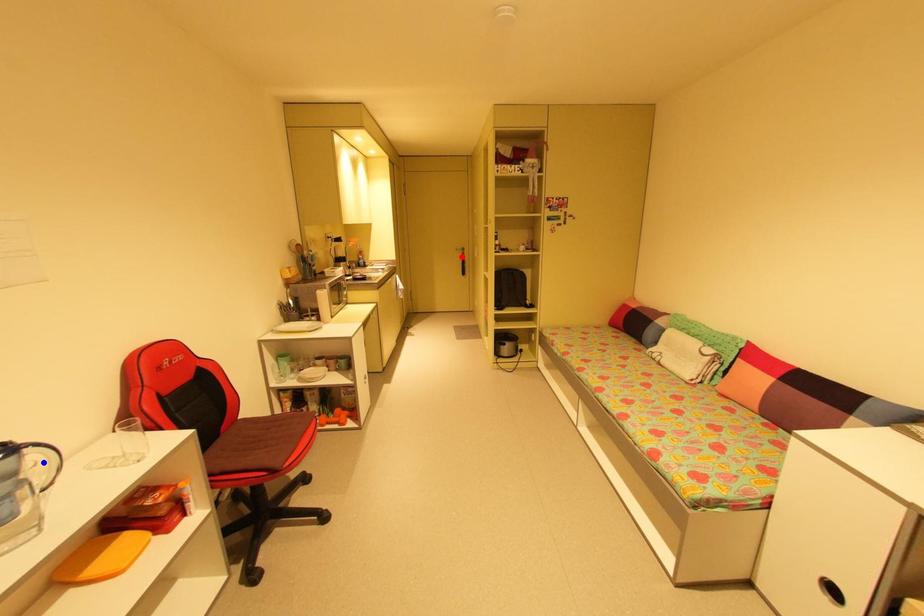
Question: Which of the two points in the image is closer to the camera?

Choices:
 (A) Blue point is closer.
 (B) Red point is closer.

Answer: (A)